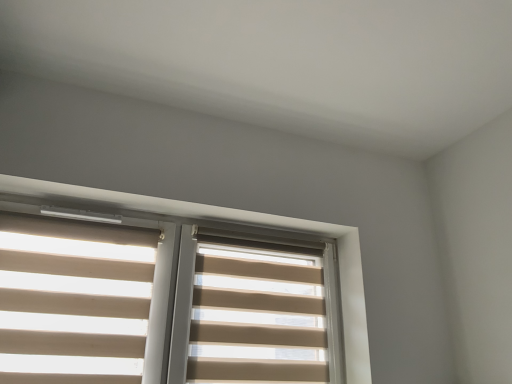
Question: From the image's perspective, is beige fabric blind at center, the 1th blind positioned from the right, above or below beige fabric blinds at upper center?

Choices:
 (A) below
 (B) above

Answer: (A)

Question: Which is correct: beige fabric blind at center, the 1th blind positioned from the right, is inside beige fabric blinds at upper center, or outside of it?

Choices:
 (A) inside
 (B) outside

Answer: (A)

Question: Which is farther from the beige fabric blinds at upper center?

Choices:
 (A) beige fabric blind at center, which is counted as the second blind, starting from the left
 (B) beige fabric blinds at left, which is the 1th blind from left to right

Answer: (B)

Question: Which object is positioned closest to the beige fabric blinds at upper center?

Choices:
 (A) beige fabric blinds at left, acting as the second blind starting from the right
 (B) beige fabric blind at center, the 1th blind positioned from the right

Answer: (B)